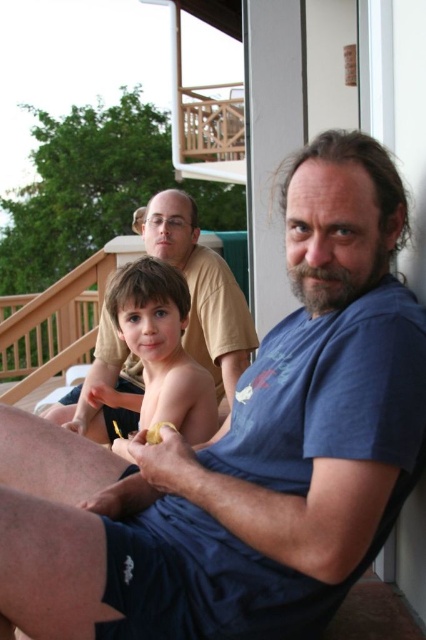
You are a photographer trying to capture a group photo of the matte yellow shirt at upper center and the smooth skin child at center. The camera you are using has a limited focus range. Considering their sizes, which subject should you focus on to ensure both are in focus?

The matte yellow shirt at upper center has a larger width than the smooth skin child at center. To ensure both are in focus, focus on the matte yellow shirt at upper center since its larger size will occupy more of the frame, allowing the smaller smooth skin child at center to fall within the depth of field.

You are a photographer trying to capture a group photo of the matte yellow shirt at upper center and the smooth skin child at center. Based on their heights, which one should you position closer to the camera to ensure both are in focus?

Since the matte yellow shirt at upper center is taller than the smooth skin child at center, you should position the smooth skin child at center closer to the camera to ensure both are in focus.